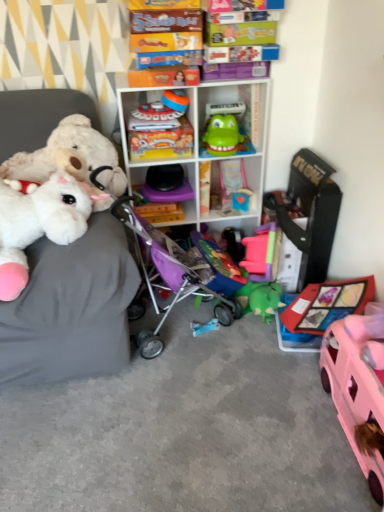
The image size is (384, 512). Describe the element at coordinates (234, 243) in the screenshot. I see `black plastic toy at center, which ranks as the 3th toy in right-to-left order` at that location.

This screenshot has height=512, width=384. Describe the element at coordinates (164, 194) in the screenshot. I see `translucent plastic xylophone at center, acting as the second shelf starting from the top` at that location.

How much space does fluffy white plush at left, which appears as the 9th toy when viewed from the right, occupy vertically?

15.46 inches.

Measure the distance between green rubber toy at center, which ranks as the 7th toy in left-to-right order, and camera.

green rubber toy at center, which ranks as the 7th toy in left-to-right order, is 5.85 feet away from camera.

What do you see at coordinates (159, 133) in the screenshot? I see `matte yellow board game at center, arranged as the seventh toy when viewed from the right` at bounding box center [159, 133].

Measure the distance between matte yellow board game at center, arranged as the seventh toy when viewed from the right, and camera.

A distance of 5.72 feet exists between matte yellow board game at center, arranged as the seventh toy when viewed from the right, and camera.

In order to click on blue fabric toy at center, acting as the sixth toy starting from the left in this screenshot , I will do `click(204, 326)`.

Find the location of a particular element. This screenshot has width=384, height=512. toy that is the 3rd object to the right of the white plastic shelf at center, the 1th shelf viewed from the top, starting at the anchor is located at coordinates (234, 243).

Looking at this image, from a real-world perspective, is white plastic shelf at center, the second shelf in the bottom-to-top sequence, positioned over black plastic toy at center, which ranks as the 3th toy in right-to-left order, based on gravity?

Yes, from a real-world perspective, white plastic shelf at center, the second shelf in the bottom-to-top sequence, is above black plastic toy at center, which ranks as the 3th toy in right-to-left order.

Considering the relative sizes of white plastic shelf at center, the second shelf in the bottom-to-top sequence, and black plastic toy at center, the eighth toy viewed from the left, in the image provided, is white plastic shelf at center, the second shelf in the bottom-to-top sequence, wider than black plastic toy at center, the eighth toy viewed from the left,?

Indeed, white plastic shelf at center, the second shelf in the bottom-to-top sequence, has a greater width compared to black plastic toy at center, the eighth toy viewed from the left.

From the picture: From a real-world perspective, which is physically below, matte yellow board game at center, arranged as the seventh toy when viewed from the right, or green rubber toy at center, which ranks as the 7th toy in left-to-right order?

In real-world perspective, matte yellow board game at center, arranged as the seventh toy when viewed from the right, is lower.

Looking at this image, which of these two, matte yellow board game at center, the 4th toy when ordered from left to right, or green rubber toy at center, which ranks as the 7th toy in left-to-right order, is smaller?

With smaller size is green rubber toy at center, which ranks as the 7th toy in left-to-right order.

From the image's perspective, is matte yellow board game at center, arranged as the seventh toy when viewed from the right, over green rubber toy at center, which ranks as the 7th toy in left-to-right order?

No, from the image's perspective, matte yellow board game at center, arranged as the seventh toy when viewed from the right, is not above green rubber toy at center, which ranks as the 7th toy in left-to-right order.

Which is more to the right, matte yellow board game at center, the 4th toy when ordered from left to right, or green rubber toy at center, which ranks as the 7th toy in left-to-right order?

green rubber toy at center, which ranks as the 7th toy in left-to-right order, is more to the right.

Does point (152, 109) appear closer or farther from the camera than point (132, 225)?

Point (152, 109).

Is shiny metallic train at upper center, which is the eighth toy in right-to-left order, looking in the opposite direction of purple fabric baby carriage at center?

shiny metallic train at upper center, which is the eighth toy in right-to-left order, is not turned away from purple fabric baby carriage at center.

Based on the photo, considering the relative positions of shiny metallic train at upper center, which is the eighth toy in right-to-left order, and purple fabric baby carriage at center in the image provided, is shiny metallic train at upper center, which is the eighth toy in right-to-left order, behind purple fabric baby carriage at center?

Yes, shiny metallic train at upper center, which is the eighth toy in right-to-left order, is behind purple fabric baby carriage at center.

Is shiny metallic train at upper center, which is the eighth toy in right-to-left order, in contact with purple fabric baby carriage at center?

No, shiny metallic train at upper center, which is the eighth toy in right-to-left order, is not next to purple fabric baby carriage at center.

From a real-world perspective, who is located higher, green rubber toy at center, which ranks as the 4th toy in right-to-left order, or translucent plastic xylophone at center, arranged as the 1th shelf when ordered from the bottom?

green rubber toy at center, which ranks as the 4th toy in right-to-left order.

The image size is (384, 512). I want to click on the 2nd shelf to the left of the green rubber toy at center, which ranks as the 4th toy in right-to-left order, starting your count from the anchor, so click(164, 194).

Can you tell me how much green rubber toy at center, which ranks as the 4th toy in right-to-left order, and translucent plastic xylophone at center, arranged as the 1th shelf when ordered from the bottom, differ in facing direction?

green rubber toy at center, which ranks as the 4th toy in right-to-left order, and translucent plastic xylophone at center, arranged as the 1th shelf when ordered from the bottom, are facing 14.7 degrees away from each other.

Is translucent plastic xylophone at center, arranged as the 1th shelf when ordered from the bottom, a part of pink plastic car at lower right, the first toy in the right-to-left sequence?

No, pink plastic car at lower right, the first toy in the right-to-left sequence, does not contain translucent plastic xylophone at center, arranged as the 1th shelf when ordered from the bottom.

In the scene shown: Does pink plastic car at lower right, the first toy in the right-to-left sequence, have a greater width compared to translucent plastic xylophone at center, acting as the second shelf starting from the top?

In fact, pink plastic car at lower right, the first toy in the right-to-left sequence, might be narrower than translucent plastic xylophone at center, acting as the second shelf starting from the top.

Could you tell me if pink plastic car at lower right, the first toy in the right-to-left sequence, is turned towards translucent plastic xylophone at center, acting as the second shelf starting from the top?

No, pink plastic car at lower right, the first toy in the right-to-left sequence, is not facing towards translucent plastic xylophone at center, acting as the second shelf starting from the top.

Who is bigger, pink plastic car at lower right, the first toy in the right-to-left sequence, or translucent plastic xylophone at center, arranged as the 1th shelf when ordered from the bottom?

pink plastic car at lower right, the first toy in the right-to-left sequence.

How much distance is there between matte plastic toy at center, which is counted as the 6th toy, starting from the right, and matte yellow board game at center, the 4th toy when ordered from left to right?

The distance of matte plastic toy at center, which is counted as the 6th toy, starting from the right, from matte yellow board game at center, the 4th toy when ordered from left to right, is 4.62 inches.

Considering the sizes of matte plastic toy at center, which is counted as the 6th toy, starting from the right, and matte yellow board game at center, the 4th toy when ordered from left to right, in the image, is matte plastic toy at center, which is counted as the 6th toy, starting from the right, wider or thinner than matte yellow board game at center, the 4th toy when ordered from left to right,?

Considering their sizes, matte plastic toy at center, which is counted as the 6th toy, starting from the right, looks slimmer than matte yellow board game at center, the 4th toy when ordered from left to right.

From the image's perspective, is matte plastic toy at center, the 5th toy when ordered from left to right, positioned above or below matte yellow board game at center, arranged as the seventh toy when viewed from the right?

matte plastic toy at center, the 5th toy when ordered from left to right, is above matte yellow board game at center, arranged as the seventh toy when viewed from the right.

From the matte yellow board game at center, the 4th toy when ordered from left to right, count 1st toy to the right and point to it. Please provide its 2D coordinates.

[(175, 100)]

Is there a large distance between fluffy white plush at left, which is the 10th toy from right to left, and black plastic toy at center, the eighth toy viewed from the left?

Yes.

Can you confirm if fluffy white plush at left, which is the 10th toy from right to left, is taller than black plastic toy at center, the eighth toy viewed from the left?

Yes.

Is fluffy white plush at left, which is the 10th toy from right to left, inside or outside of black plastic toy at center, which ranks as the 3th toy in right-to-left order?

fluffy white plush at left, which is the 10th toy from right to left, is not enclosed by black plastic toy at center, which ranks as the 3th toy in right-to-left order.

Is fluffy white plush at left, the 1th toy when ordered from left to right, bigger or smaller than black plastic toy at center, the eighth toy viewed from the left?

Clearly, fluffy white plush at left, the 1th toy when ordered from left to right, is larger in size than black plastic toy at center, the eighth toy viewed from the left.

The height and width of the screenshot is (512, 384). In order to click on the 1st shelf counting from the left side of the black plastic toy at center, the eighth toy viewed from the left in this screenshot , I will do `click(201, 143)`.

There is a green rubber toy at center, which ranks as the 7th toy in left-to-right order. Where is `the 1st toy below it (from the image's perspective)`? Image resolution: width=384 pixels, height=512 pixels. the 1st toy below it (from the image's perspective) is located at coordinates (159, 133).

Which object lies further to the anchor point matte plastic toy at center, which is counted as the 6th toy, starting from the right, matte yellow board game at center, arranged as the seventh toy when viewed from the right, or purple fabric baby carriage at center?

purple fabric baby carriage at center.

Looking at the image, which one is located further to pink plastic car at lower right, acting as the tenth toy starting from the left, purple fabric baby carriage at center or fluffy white stuffed animals on the left?

fluffy white stuffed animals on the left lies further to pink plastic car at lower right, acting as the tenth toy starting from the left, than the other object.

When comparing their distances from pink plastic car at lower right, acting as the tenth toy starting from the left, does blue fabric toy at center, acting as the sixth toy starting from the left, or shiny metallic train at upper center, which is counted as the third toy, starting from the left, seem closer?

blue fabric toy at center, acting as the sixth toy starting from the left, is positioned closer to the anchor pink plastic car at lower right, acting as the tenth toy starting from the left.

Based on their spatial positions, is blue plastic toy at center, the ninth toy viewed from the left, or matte yellow board game at center, the 4th toy when ordered from left to right, closer to shiny metallic train at upper center, which is the eighth toy in right-to-left order?

The object closer to shiny metallic train at upper center, which is the eighth toy in right-to-left order, is matte yellow board game at center, the 4th toy when ordered from left to right.

Which object lies further to the anchor point green rubber toy at center, which ranks as the 4th toy in right-to-left order, fluffy white plush at left, the 2th toy viewed from the left, or black plastic toy at center, which ranks as the 3th toy in right-to-left order?

Among the two, black plastic toy at center, which ranks as the 3th toy in right-to-left order, is located further to green rubber toy at center, which ranks as the 4th toy in right-to-left order.

When comparing their distances from green rubber toy at center, which ranks as the 4th toy in right-to-left order, does fluffy white plush at left, which is the 10th toy from right to left, or matte yellow board game at center, arranged as the seventh toy when viewed from the right, seem further?

The object further to green rubber toy at center, which ranks as the 4th toy in right-to-left order, is fluffy white plush at left, which is the 10th toy from right to left.

From the image, which object appears to be farther from blue fabric toy at center, acting as the sixth toy starting from the left, blue plastic toy at center, the ninth toy viewed from the left, or matte plastic toy at center, the 5th toy when ordered from left to right?

matte plastic toy at center, the 5th toy when ordered from left to right.

Based on their spatial positions, is fluffy white plush at left, the 1th toy when ordered from left to right, or purple fabric baby carriage at center closer to shiny metallic train at upper center, which is the eighth toy in right-to-left order?

purple fabric baby carriage at center is closer to shiny metallic train at upper center, which is the eighth toy in right-to-left order.

Identify the location of shelf between fluffy white stuffed animals on the left and shiny metallic train at upper center, which is counted as the third toy, starting from the left, along the z-axis. (201, 143).

Identify the location of shelf that lies between matte plastic toy at center, which is counted as the 6th toy, starting from the right, and translucent plastic xylophone at center, arranged as the 1th shelf when ordered from the bottom, from top to bottom. This screenshot has height=512, width=384. (201, 143).

The image size is (384, 512). In order to click on baby carriage between fluffy white plush at left, the 1th toy when ordered from left to right, and pink plastic car at lower right, the first toy in the right-to-left sequence in this screenshot , I will do `click(168, 273)`.

The image size is (384, 512). I want to click on baby carriage between matte yellow board game at center, arranged as the seventh toy when viewed from the right, and pink plastic car at lower right, acting as the tenth toy starting from the left, from top to bottom, so point(168,273).